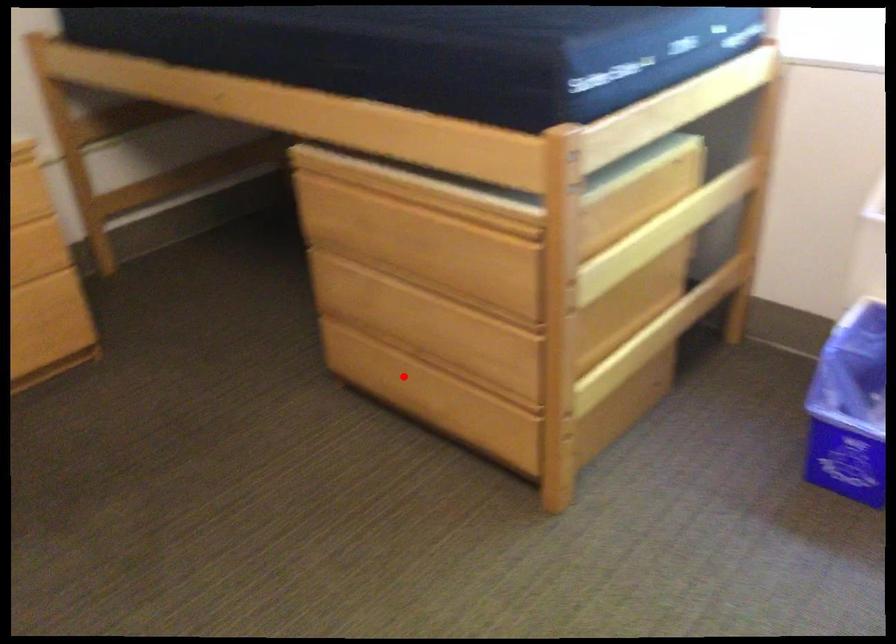
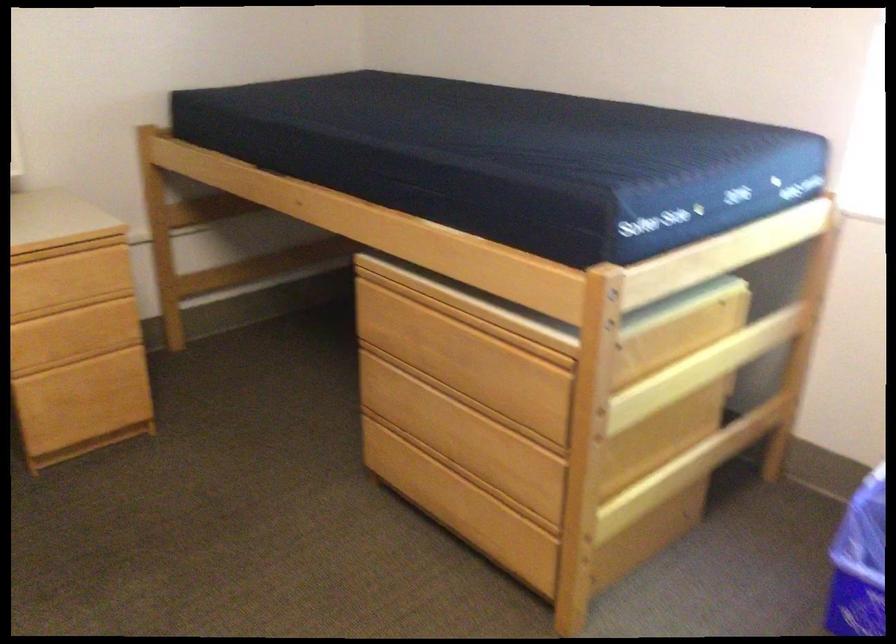
Where in the second image is the point corresponding to the highlighted location from the first image?

(434, 483)